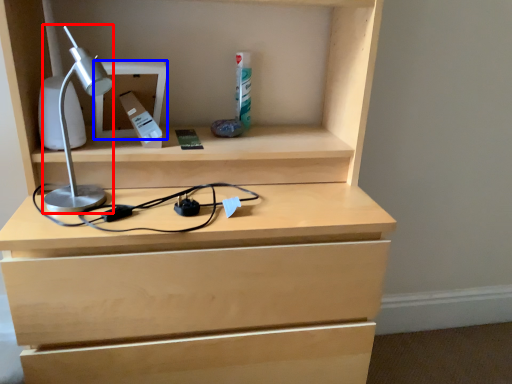
Question: Which of the following is the farthest to the observer, lamp (highlighted by a red box) or cabinet (highlighted by a blue box)?

Choices:
 (A) lamp
 (B) cabinet

Answer: (B)